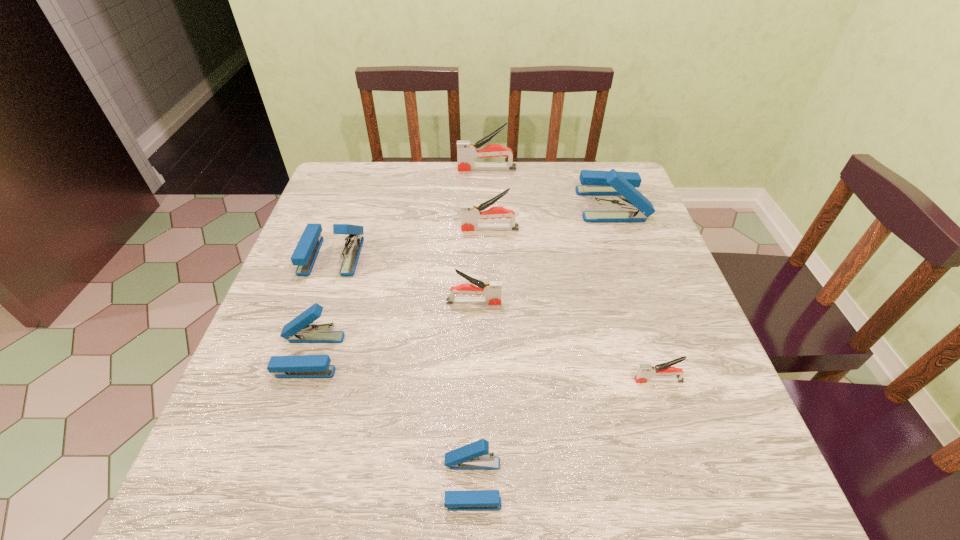
You are a GUI agent. You are given a task and a screenshot of the screen. Output one action in this format:
    pyautogui.click(x=<x>, y=<y>)
    Task: Click on the vacant space located 0.150m on the handle side of the second farthest gray stapler
    
    Given the screenshot: What is the action you would take?
    pyautogui.click(x=404, y=229)

The height and width of the screenshot is (540, 960). Identify the location of free location located on the handle side of the second farthest gray stapler. (400, 229).

This screenshot has height=540, width=960. I want to click on vacant space located on the back of the fifth nearest object, so click(x=348, y=212).

Where is `free space located on the handle side of the fifth farthest object`? This screenshot has height=540, width=960. free space located on the handle side of the fifth farthest object is located at coordinates (628, 302).

I want to click on free spot located on the back of the third farthest blue stapler, so click(343, 255).

The width and height of the screenshot is (960, 540). In order to click on vacant space located on the handle side of the smallest gray stapler in this screenshot , I will do `click(487, 380)`.

Locate an element on the screen. This screenshot has width=960, height=540. vacant space situated 0.130m on the handle side of the smallest gray stapler is located at coordinates (566, 380).

Locate an element on the screen. vacant space located on the handle side of the smallest gray stapler is located at coordinates (598, 380).

At what (x,y) coordinates should I click in order to perform the action: click on vacant region located 0.130m on the right of the nearest blue stapler. Please return your answer as a coordinate pair (x, y). Image resolution: width=960 pixels, height=540 pixels. Looking at the image, I should click on (583, 483).

Locate an element on the screen. The height and width of the screenshot is (540, 960). object that is at the near edge is located at coordinates (475, 456).